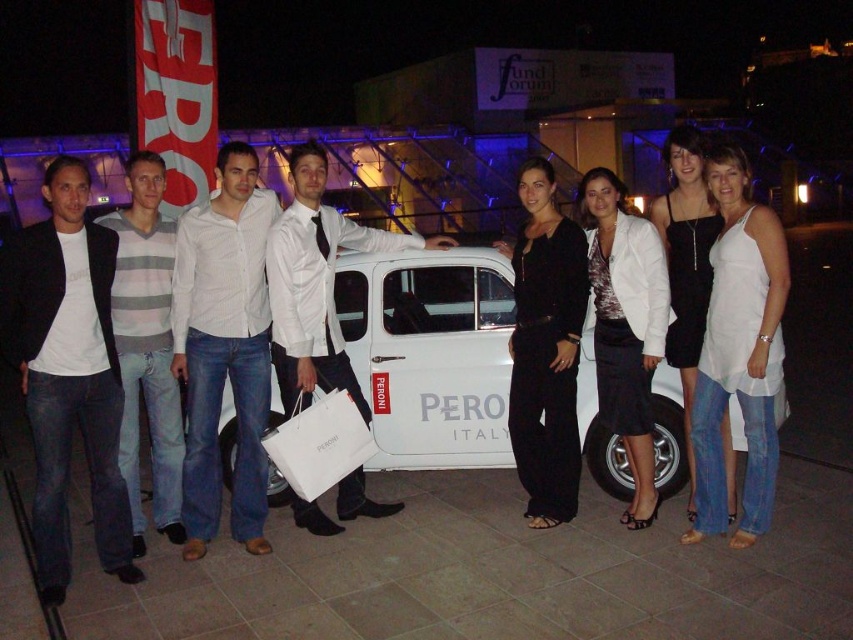
Can you confirm if white matte car at center is positioned to the left of white textured blazer at center?

Correct, you'll find white matte car at center to the left of white textured blazer at center.

Where is `white matte car at center`? white matte car at center is located at coordinates [x=430, y=353].

How distant is white textured blazer at center from black satin dress at center?

white textured blazer at center and black satin dress at center are 12.18 inches apart.

Which is above, white textured blazer at center or black satin dress at center?

black satin dress at center

This screenshot has height=640, width=853. In order to click on white textured blazer at center in this screenshot , I will do `click(625, 326)`.

At what (x,y) coordinates should I click in order to perform the action: click on white textured blazer at center. Please return your answer as a coordinate pair (x, y). The image size is (853, 640). Looking at the image, I should click on (625, 326).

Can you confirm if white cotton tank top at center is positioned to the right of black matte pants at center?

Correct, you'll find white cotton tank top at center to the right of black matte pants at center.

Is white cotton tank top at center above black matte pants at center?

No, white cotton tank top at center is not above black matte pants at center.

What do you see at coordinates (740, 349) in the screenshot? I see `white cotton tank top at center` at bounding box center [740, 349].

At what (x,y) coordinates should I click in order to perform the action: click on white cotton tank top at center. Please return your answer as a coordinate pair (x, y). This screenshot has width=853, height=640. Looking at the image, I should click on (740, 349).